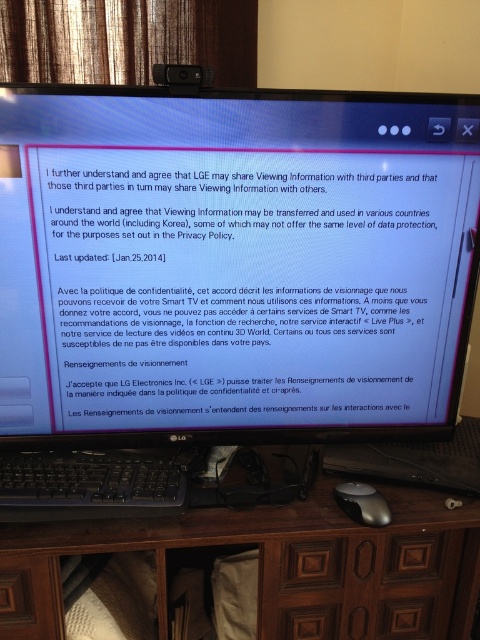
This screenshot has width=480, height=640. What do you see at coordinates (233, 260) in the screenshot?
I see `white paper at center` at bounding box center [233, 260].

Who is more forward, (x=87, y=333) or (x=80, y=515)?

Point (x=80, y=515) is more forward.

Find the location of a particular element. This screenshot has height=640, width=480. white paper at center is located at coordinates (233, 260).

Is brown wood computer desk at center to the left of black plastic keyboard at lower center from the viewer's perspective?

In fact, brown wood computer desk at center is to the right of black plastic keyboard at lower center.

Does brown wood computer desk at center have a lesser width compared to black plastic keyboard at lower center?

No.

Between point (27, 596) and point (17, 515), which one is positioned in front?

Positioned in front is point (17, 515).

Locate an element on the screen. brown wood computer desk at center is located at coordinates click(x=280, y=564).

Does white paper at center have a greater width compared to satin silver mouse at lower center?

Yes.

Who is higher up, white paper at center or satin silver mouse at lower center?

white paper at center is higher up.

Is point (364, 273) in front of point (348, 506)?

No, it is not.

The height and width of the screenshot is (640, 480). I want to click on white paper at center, so click(233, 260).